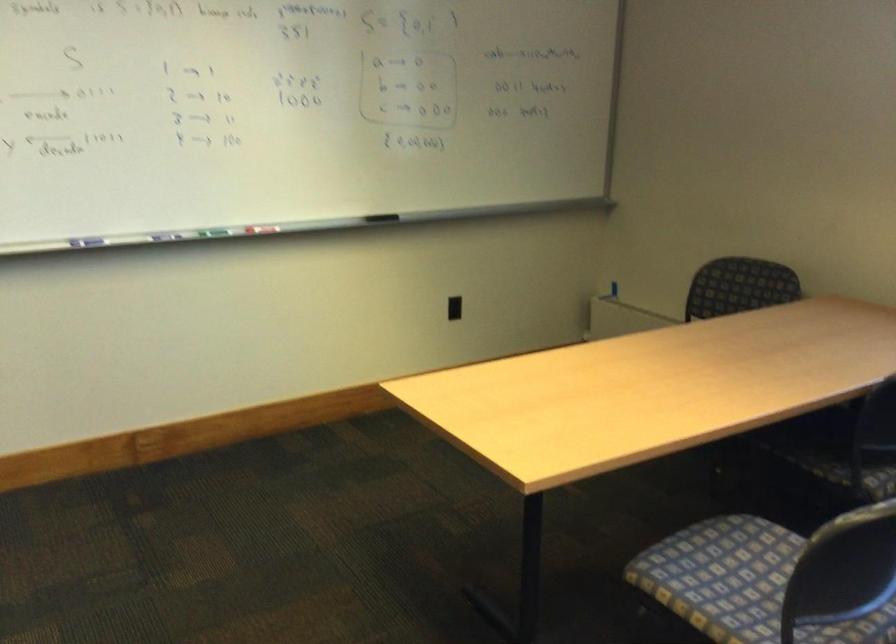
You are a GUI agent. You are given a task and a screenshot of the screen. Output one action in this format:
    pyautogui.click(x=<x>, y=<y>)
    Task: Click on the chair sitting surface
    The image size is (896, 644).
    Given the screenshot: What is the action you would take?
    pyautogui.click(x=724, y=576)